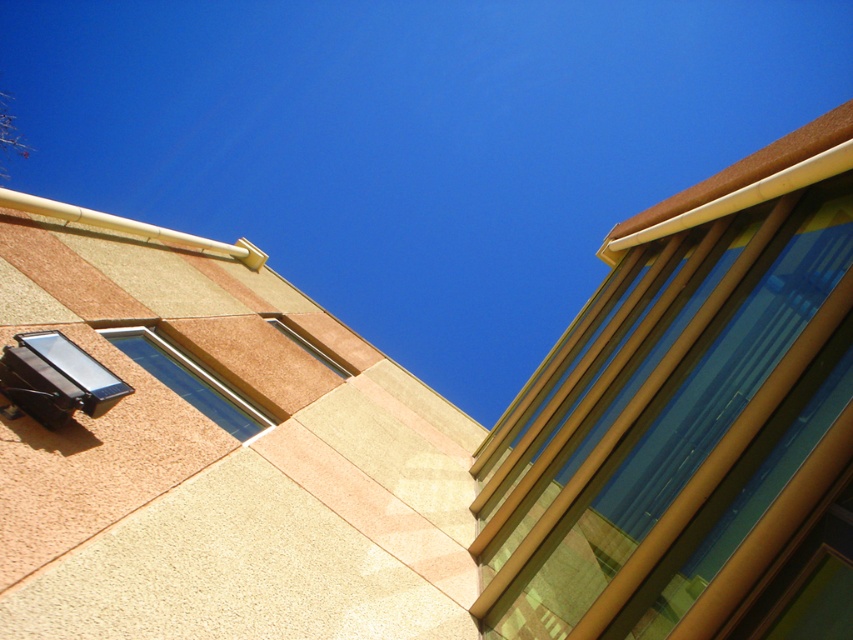
Looking at this image, you are standing in front of the modern building and want to clean the black plastic window at lower left and the metallic silver window at upper center. Which window will require you to climb a ladder to reach?

The metallic silver window at upper center will require a ladder because it is further away from the viewer compared to the black plastic window at lower left, which is closer and may be reachable without a ladder.

You are standing in front of the building and want to see the view through the clear glass window at upper left. Can you see the black plastic window at lower left through it?

The black plastic window at lower left is behind the clear glass window at upper left, so you cannot see the black plastic window at lower left through the clear glass window at upper left.

You are an architect designing a new building and want to ensure proper ventilation. You have two windows to consider in the design plan. The clear glass window at upper left and the black plastic window at lower left. Which window should you choose if you need a taller window for better airflow?

The clear glass window at upper left is much taller than the black plastic window at lower left, so you should choose the clear glass window at upper left for better airflow.